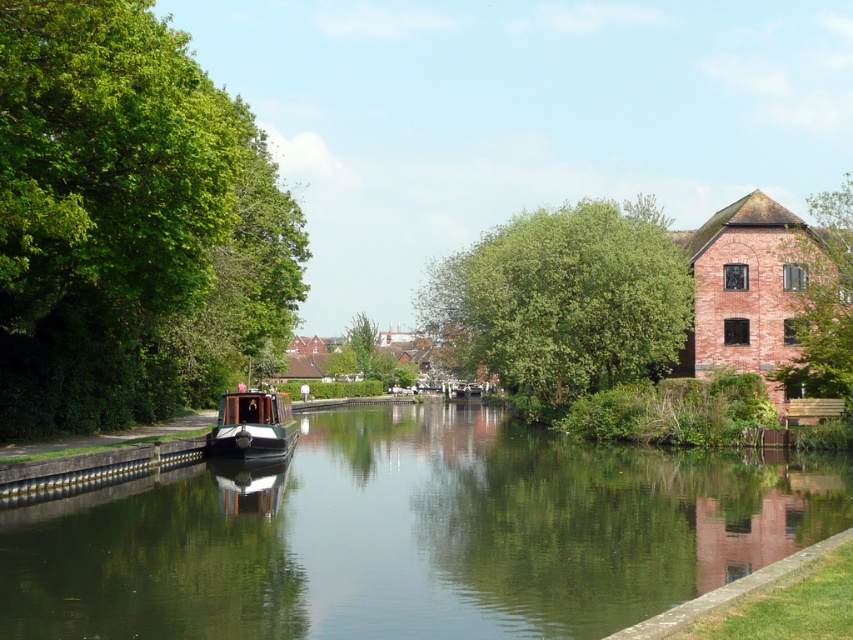
Question: In this image, where is green leafy tree at center located relative to green leafy tree at upper right?

Choices:
 (A) left
 (B) right

Answer: (A)

Question: Is green leafy tree at left to the right of polished wood boat at center from the viewer's perspective?

Choices:
 (A) yes
 (B) no

Answer: (B)

Question: Which of these objects is positioned closest to the green leafy tree at center?

Choices:
 (A) green leafy tree at left
 (B) green smooth water at center

Answer: (A)

Question: Does green smooth water at center have a greater width compared to green leafy tree at center?

Choices:
 (A) no
 (B) yes

Answer: (A)

Question: Which point appears farthest from the camera in this image?

Choices:
 (A) (227, 445)
 (B) (810, 333)
 (C) (590, 240)
 (D) (120, 493)

Answer: (C)

Question: Which of these objects is positioned farthest from the green leafy tree at left?

Choices:
 (A) green smooth water at center
 (B) green leafy tree at upper right

Answer: (B)